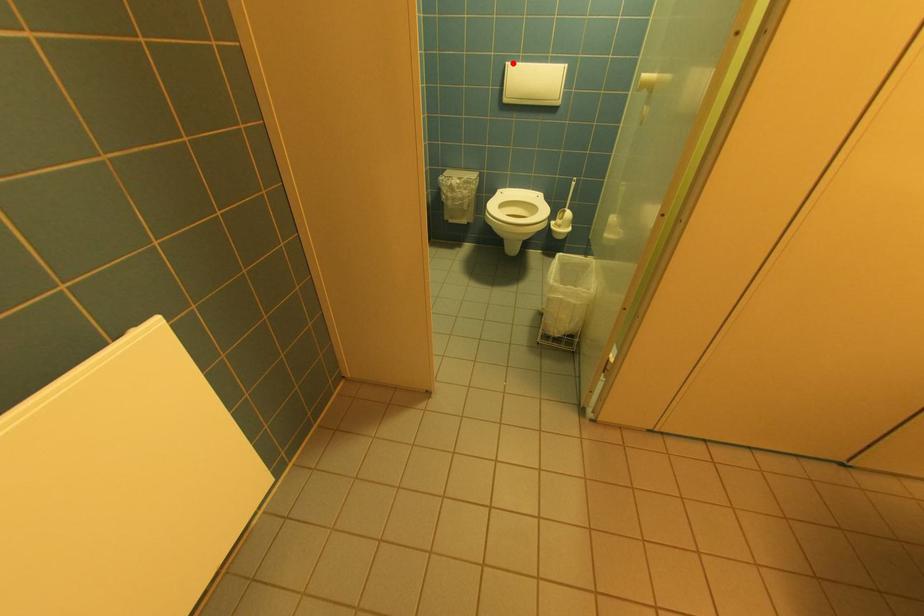
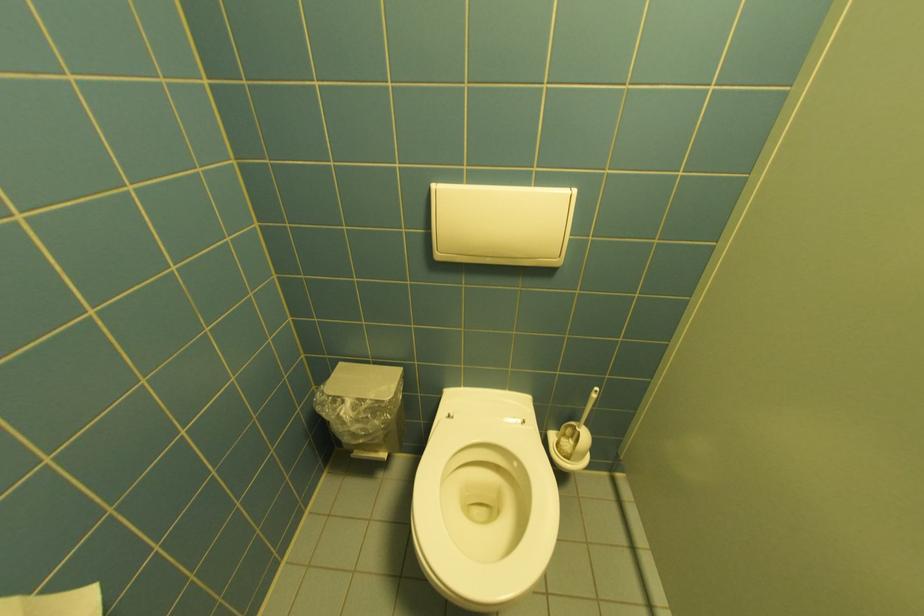
Question: I am providing you with two images of the same scene from different viewpoints. In image1, a red point is highlighted. Considering the same 3D point in image2, which of the following is correct?

Choices:
 (A) It is closer
 (B) It is farther

Answer: (B)